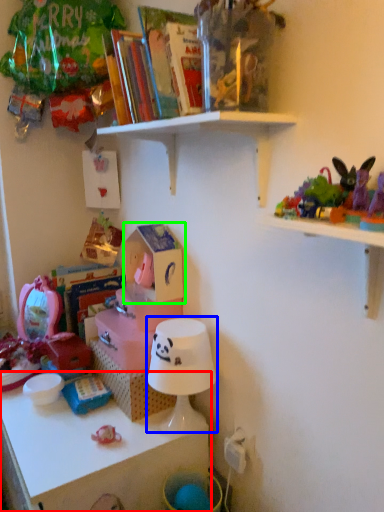
Question: Considering the real-world distances, which object is closest to shelf (highlighted by a red box)? lamp (highlighted by a blue box) or storage box (highlighted by a green box).

Choices:
 (A) lamp
 (B) storage box

Answer: (A)